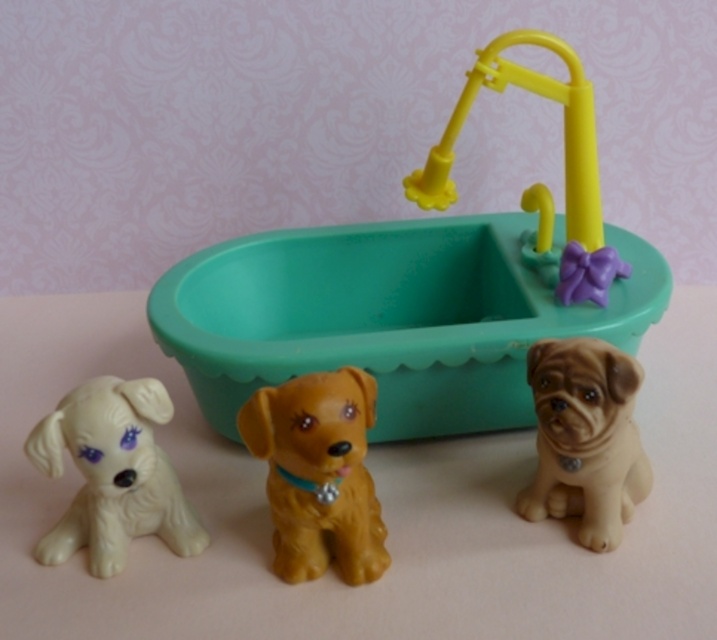
You are standing in front of the scene. Where is the teal plastic bathtub at center located in terms of coordinates?

The teal plastic bathtub at center is located at coordinates point (389, 316).

You are a small toy dog needing to jump into the teal plastic bathtub at center. You are currently standing next to the shiny brown dog at center. Can you reach the bathtub in one jump if your maximum jump distance is 10 inches?

The distance between the teal plastic bathtub at center and the shiny brown dog at center is 10.64 inches. Since your maximum jump distance is 10 inches, you cannot reach the bathtub in one jump.